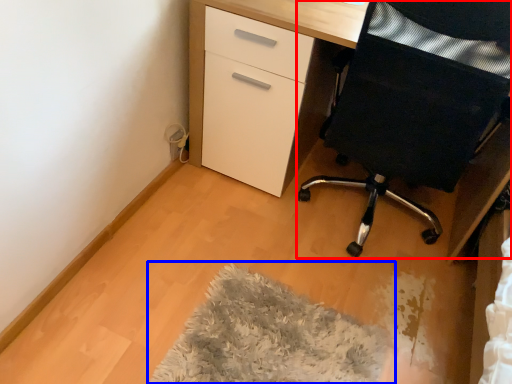
Question: Among these objects, which one is farthest to the camera, furniture (highlighted by a red box) or mat (highlighted by a blue box)?

Choices:
 (A) furniture
 (B) mat

Answer: (B)